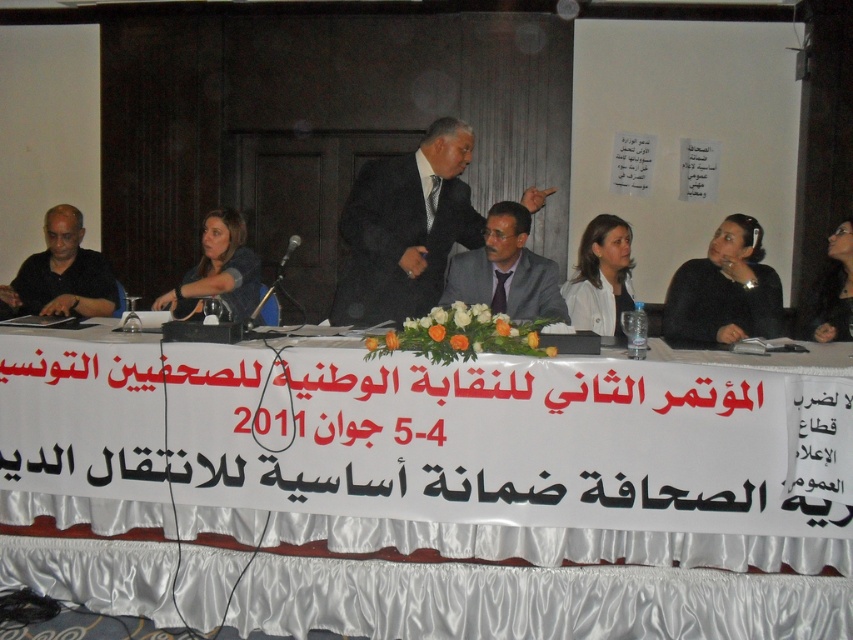
Question: Considering the real-world distances, which object is closest to the white satin tablecloth at center?

Choices:
 (A) matte black shirt at left
 (B) gray suit at center
 (C) black suit at center

Answer: (B)

Question: Estimate the real-world distances between objects in this image. Which object is closer to the gray suit at center?

Choices:
 (A) matte black jacket at left
 (B) white satin tablecloth at center
 (C) black fabric at lower right

Answer: (C)

Question: Can you confirm if black suit at center is positioned above matte black shirt at left?

Choices:
 (A) no
 (B) yes

Answer: (B)

Question: Where is black suit at center located in relation to black fabric at lower right in the image?

Choices:
 (A) right
 (B) left

Answer: (B)

Question: Which object appears closest to the camera in this image?

Choices:
 (A) black suit at center
 (B) gray suit at center
 (C) matte black shirt at left

Answer: (B)

Question: Can you confirm if matte black shirt at left is wider than matte black jacket at left?

Choices:
 (A) yes
 (B) no

Answer: (A)